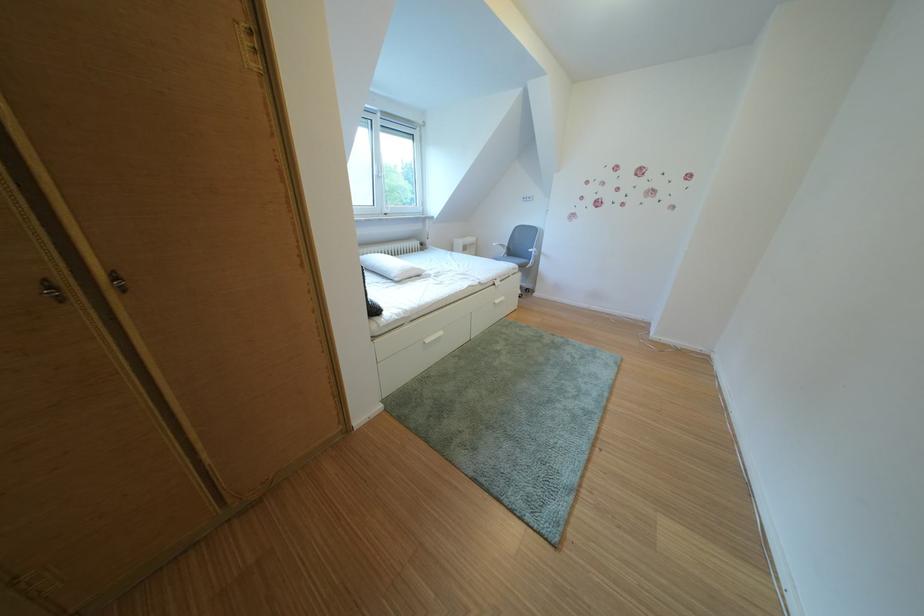
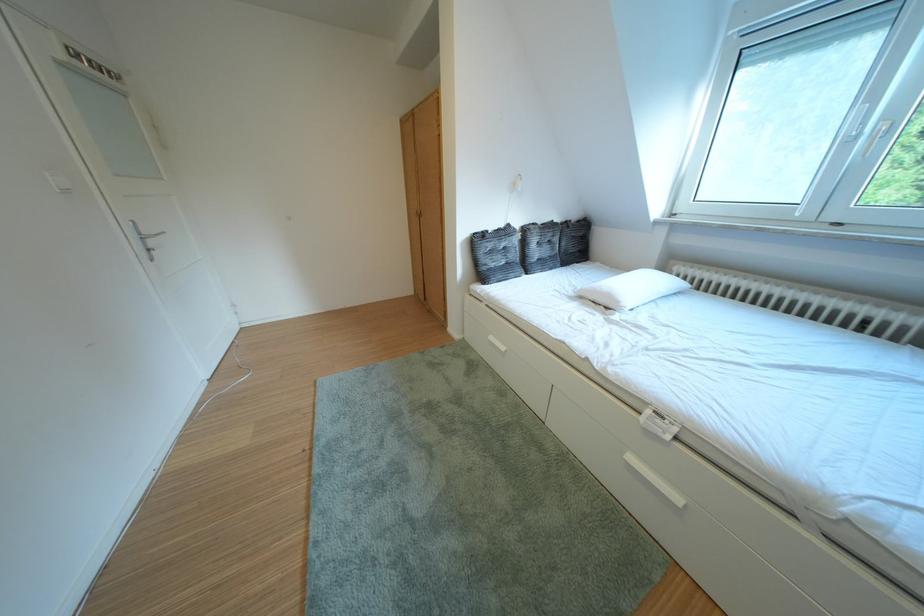
Find the pixel in the second image that matches point 428,274 in the first image.

(623, 301)